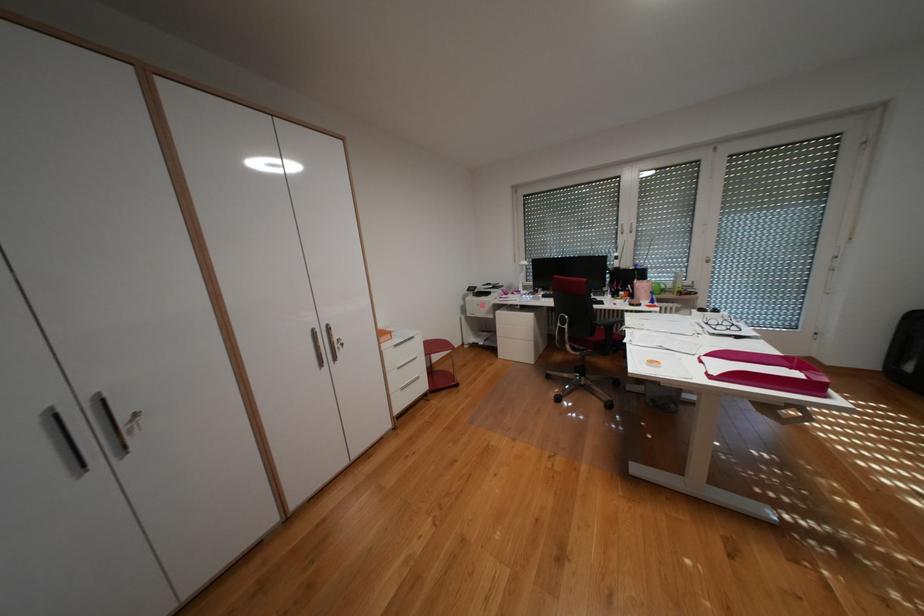
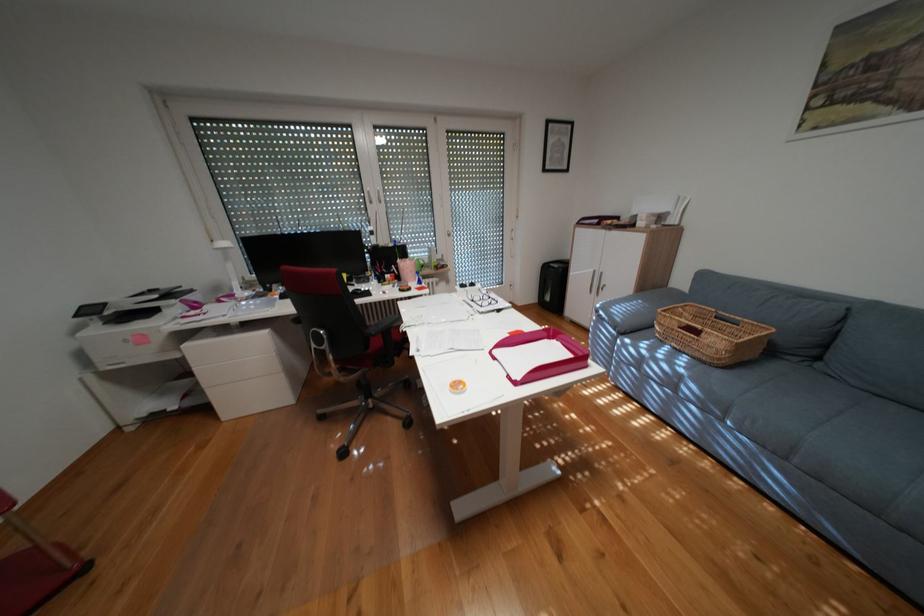
Question: Based on the continuous images, in which direction is the camera rotating? Reply with the corresponding letter.

Choices:
 (A) Left
 (B) Right
 (C) Up
 (D) Down

Answer: (B)